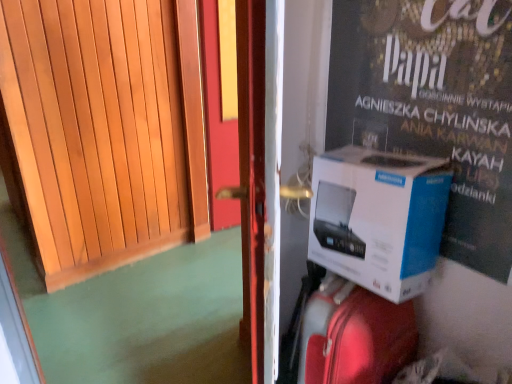
From a real-world perspective, Pinpoint a few locations in the empty space that is ontop of white cardboard box at right. Your answer should be formatted as a list of tuples, i.e. [(x1, y1)], where each tuple contains the x and y coordinates of a point satisfying the conditions above.

[(0.787, -0.003)]